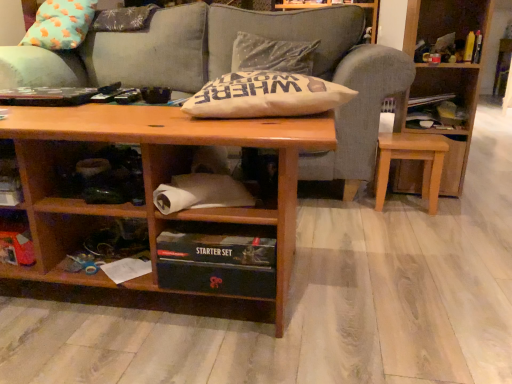
You are a GUI agent. You are given a task and a screenshot of the screen. Output one action in this format:
    pyautogui.click(x=<x>, y=<y>)
    Task: Click on the free space above black cardboard box at lower center, arranged as the 1th cabinet when ordered from the bottom (from a real-world perspective)
    
    Given the screenshot: What is the action you would take?
    pyautogui.click(x=216, y=233)